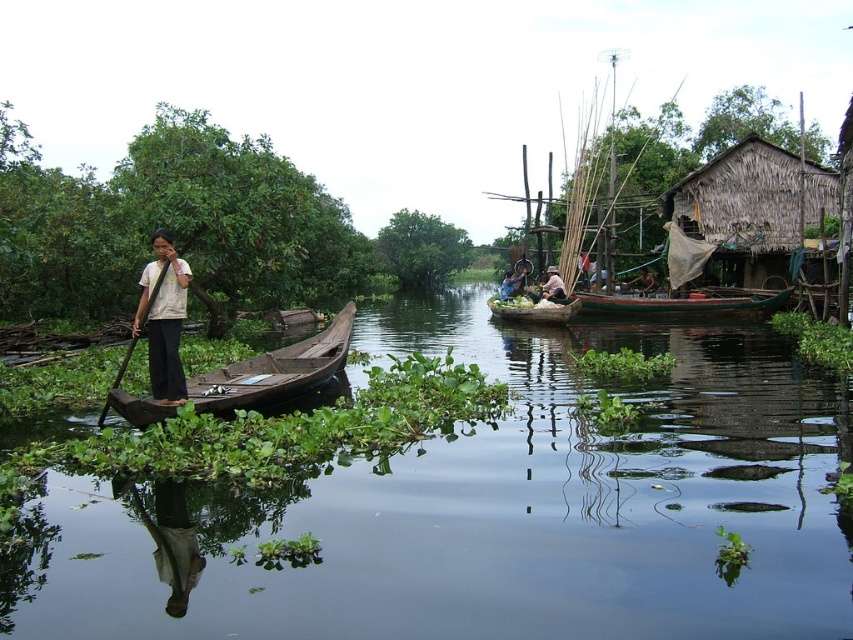
Can you confirm if wooden canoe at left is shorter than green leafy plant at center?

Yes.

Looking at this image, who is more forward, (x=299, y=378) or (x=431, y=230)?

Point (x=299, y=378) is in front.

Is point (204, 378) positioned after point (376, 244)?

No, (204, 378) is in front of (376, 244).

You are a GUI agent. You are given a task and a screenshot of the screen. Output one action in this format:
    pyautogui.click(x=<x>, y=<y>)
    Task: Click on the wooden canoe at left
    This screenshot has height=640, width=853.
    Given the screenshot: What is the action you would take?
    pyautogui.click(x=276, y=371)

Can you confirm if green wooden canoe at center is positioned to the right of dark brown wooden boat at center?

In fact, green wooden canoe at center is to the left of dark brown wooden boat at center.

Where is `green wooden canoe at center`? green wooden canoe at center is located at coordinates (534, 308).

Identify the location of green wooden canoe at center. (534, 308).

Measure the distance between point (x=146, y=310) and camera.

Point (x=146, y=310) and camera are 12.79 meters apart.

Which is more to the right, brown wood paddle at left or dark brown wooden boat at center?

dark brown wooden boat at center is more to the right.

Which is in front, point (163, 269) or point (645, 284)?

Positioned in front is point (163, 269).

Where is `brown wood paddle at left`? brown wood paddle at left is located at coordinates (154, 292).